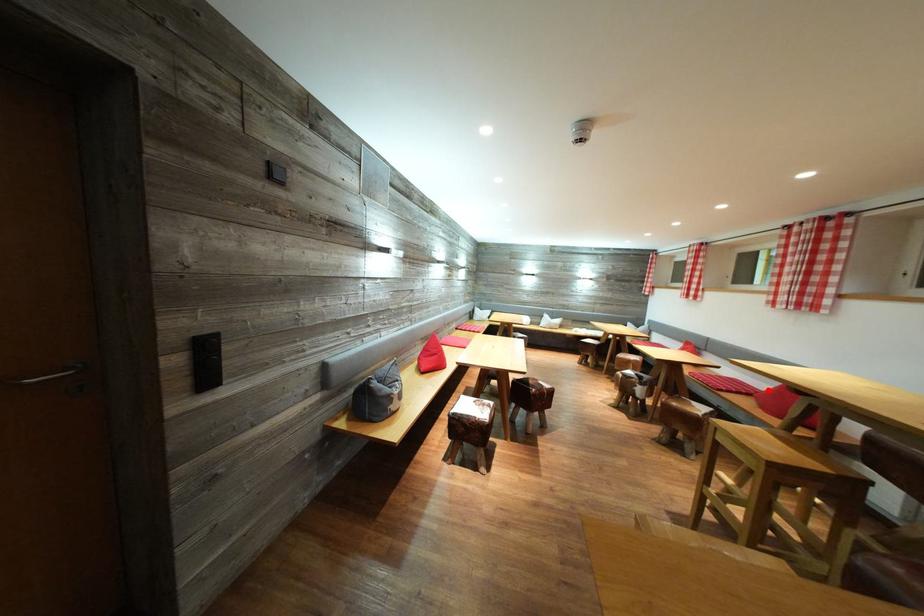
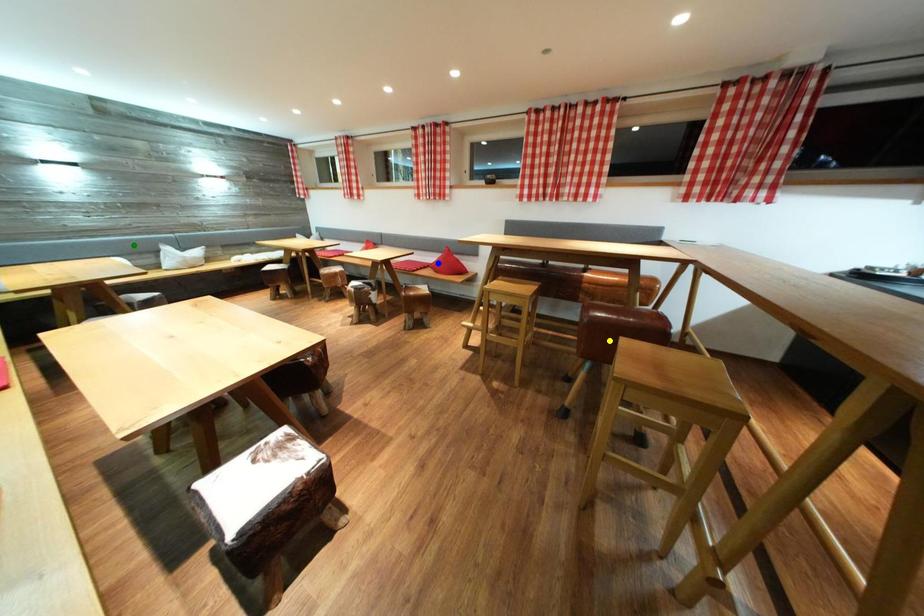
Question: I am providing you with two images of the same scene from different viewpoints. A red point is marked on the first image. You are given multiple points on the second image. Which mark in image 2 goes with the point in image 1?

Choices:
 (A) green point
 (B) yellow point
 (C) blue point

Answer: (C)